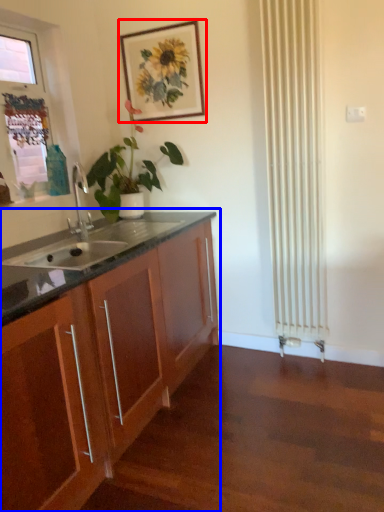
Question: Among these objects, which one is nearest to the camera, picture frame (highlighted by a red box) or cabinetry (highlighted by a blue box)?

Choices:
 (A) picture frame
 (B) cabinetry

Answer: (B)